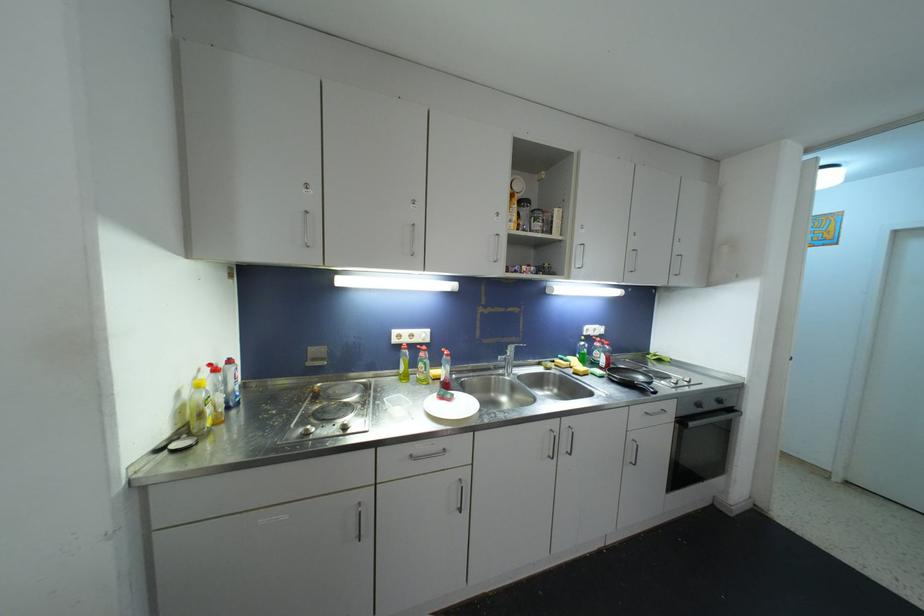
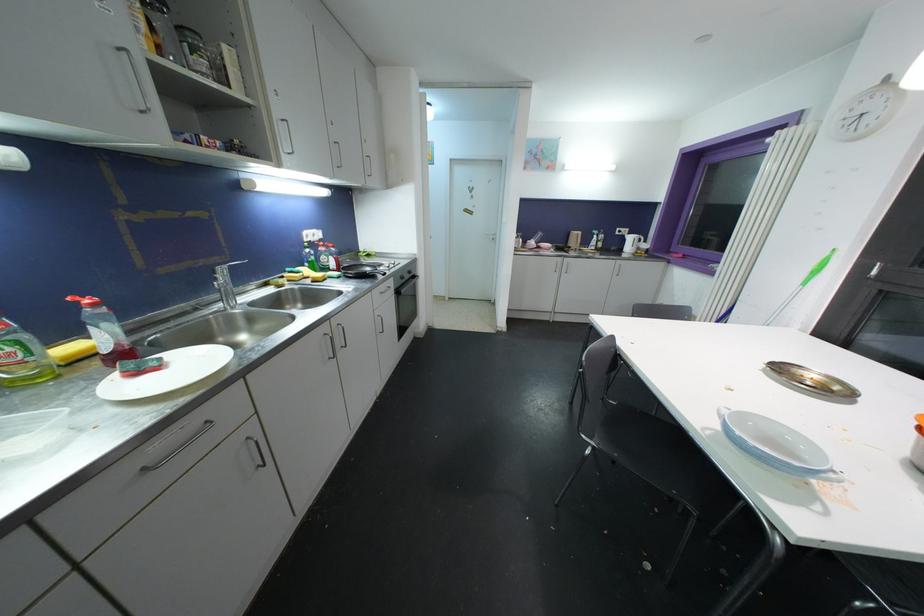
Find the pixel in the second image that matches (685,424) in the first image.

(400, 294)